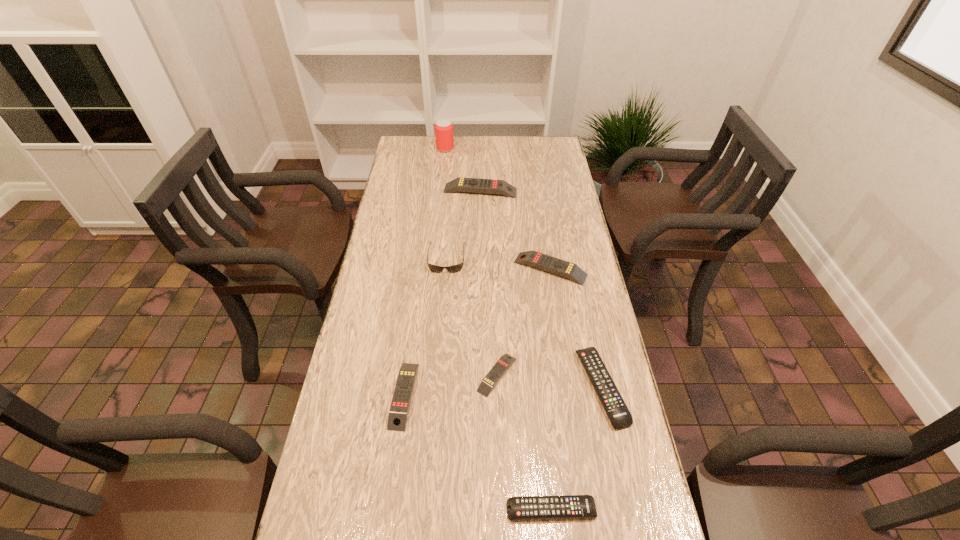
I want to click on yellow remote control object that ranks as the third closest to the second biggest yellow remote control, so click(x=397, y=419).

Point out which yellow remote control is positioned as the second nearest to the smallest yellow remote control. Please provide its 2D coordinates. Your answer should be formatted as a tuple, i.e. [(x, y)], where the tuple contains the x and y coordinates of a point satisfying the conditions above.

[(563, 268)]

Identify the location of black remote control object that ranks as the closest to the smallest yellow remote control. This screenshot has width=960, height=540. (619, 415).

The image size is (960, 540). I want to click on vacant region that satisfies the following two spatial constraints: 1. on the back side of the third biggest yellow remote control; 2. on the right side of the smallest yellow remote control, so click(407, 375).

At what (x,y) coordinates should I click in order to perform the action: click on vacant area in the image that satisfies the following two spatial constraints: 1. on the front side of the nearer black remote control; 2. on the left side of the leftmost remote control. Please return your answer as a coordinate pair (x, y). Looking at the image, I should click on (389, 509).

In order to click on free location that satisfies the following two spatial constraints: 1. on the front-facing side of the sunglasses; 2. on the left side of the left black remote control in this screenshot , I will do `click(427, 509)`.

Image resolution: width=960 pixels, height=540 pixels. I want to click on vacant space that satisfies the following two spatial constraints: 1. on the front side of the farther black remote control; 2. on the left side of the tallest remote control, so click(x=480, y=387).